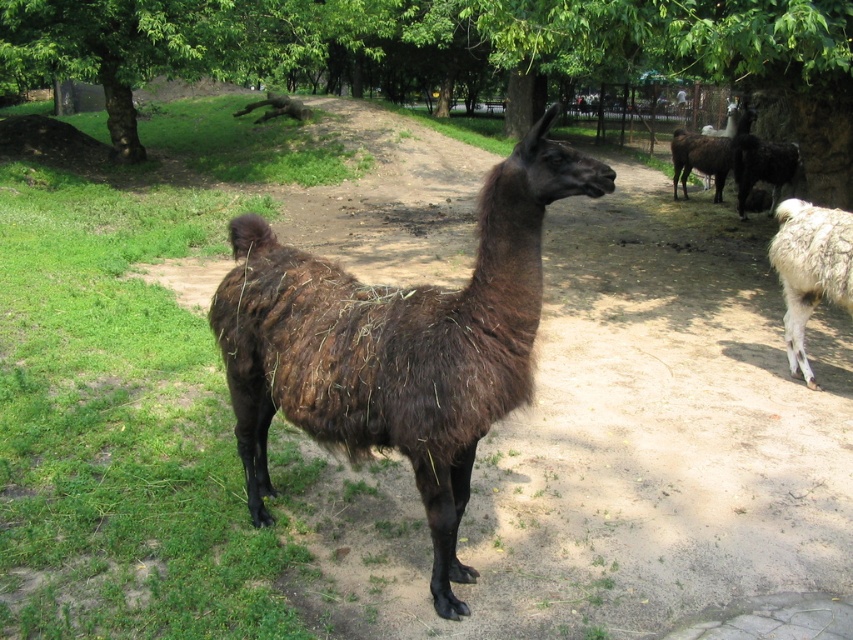
Between brown fuzzy alpaca at center and dark brown woolly alpaca at upper right, which one has less height?

Standing shorter between the two is dark brown woolly alpaca at upper right.

The width and height of the screenshot is (853, 640). What do you see at coordinates (397, 344) in the screenshot?
I see `brown fuzzy alpaca at center` at bounding box center [397, 344].

Between point (364, 419) and point (722, 154), which one is positioned in front?

Point (364, 419) is in front.

This screenshot has width=853, height=640. I want to click on brown fuzzy alpaca at center, so click(x=397, y=344).

Between point (268, 483) and point (839, 241), which one is positioned behind?

The point (839, 241) is more distant.

Does brown fuzzy alpaca at center come behind white woolly alpaca at right?

That is False.

What do you see at coordinates (397, 344) in the screenshot? This screenshot has height=640, width=853. I see `brown fuzzy alpaca at center` at bounding box center [397, 344].

Where is `brown fuzzy alpaca at center`? The width and height of the screenshot is (853, 640). brown fuzzy alpaca at center is located at coordinates (397, 344).

Can you confirm if white woolly alpaca at right is thinner than dark brown woolly alpaca at upper right?

Yes, white woolly alpaca at right is thinner than dark brown woolly alpaca at upper right.

Can you confirm if white woolly alpaca at right is smaller than dark brown woolly alpaca at upper right?

Yes, white woolly alpaca at right is smaller than dark brown woolly alpaca at upper right.

At what (x,y) coordinates should I click in order to perform the action: click on white woolly alpaca at right. Please return your answer as a coordinate pair (x, y). This screenshot has width=853, height=640. Looking at the image, I should click on (810, 269).